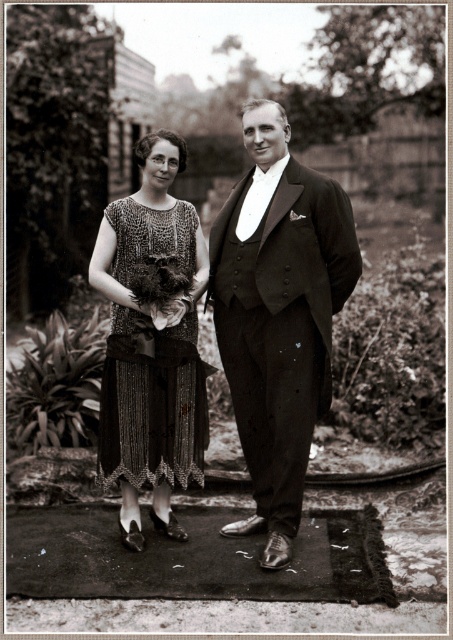
Question: Can you confirm if smooth black suit at center is positioned to the left of sequined fabric dress at center?

Choices:
 (A) no
 (B) yes

Answer: (A)

Question: Is smooth black suit at center further to camera compared to sequined fabric dress at center?

Choices:
 (A) yes
 (B) no

Answer: (B)

Question: Is smooth black suit at center below sequined fabric dress at center?

Choices:
 (A) yes
 (B) no

Answer: (B)

Question: Which object is farther from the camera taking this photo?

Choices:
 (A) sequined fabric dress at center
 (B) smooth black suit at center

Answer: (A)

Question: Among these objects, which one is farthest from the camera?

Choices:
 (A) sequined fabric dress at center
 (B) smooth black suit at center

Answer: (A)

Question: Which point is closer to the camera taking this photo?

Choices:
 (A) (298, 257)
 (B) (169, 240)

Answer: (A)